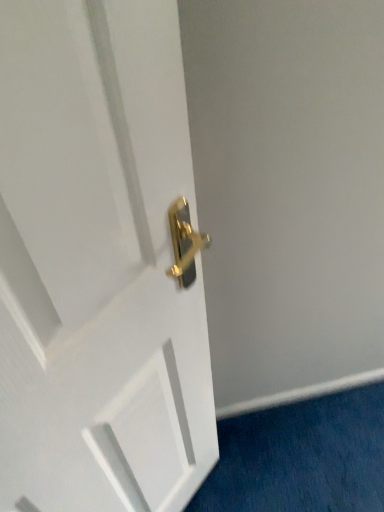
What do you see at coordinates (98, 263) in the screenshot? I see `white matte door handle at center` at bounding box center [98, 263].

Locate an element on the screen. white matte door handle at center is located at coordinates (98, 263).

Locate an element on the screen. The image size is (384, 512). white matte door handle at center is located at coordinates (98, 263).